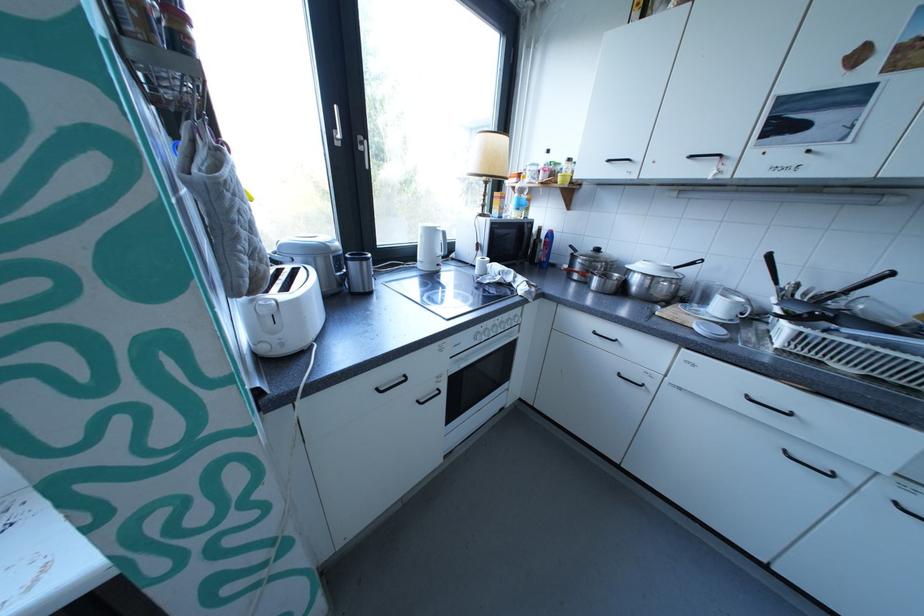
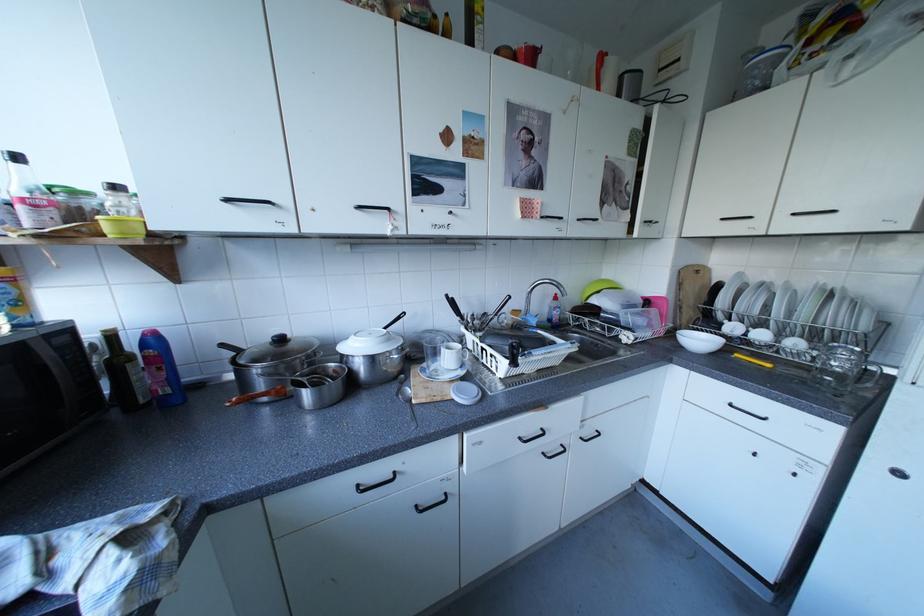
The point at (760, 395) is marked in the first image. Where is the corresponding point in the second image?

(532, 439)